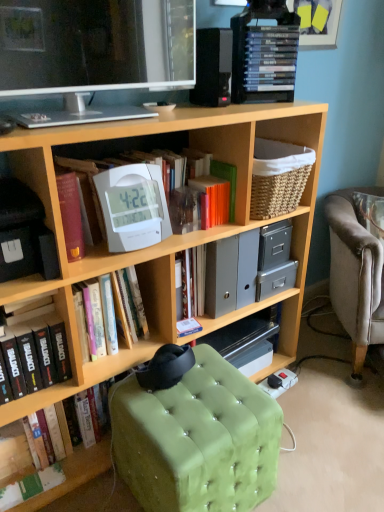
In order to click on vacant space situated above black cardboard box at left (from a real-world perspective) in this screenshot , I will do `click(19, 192)`.